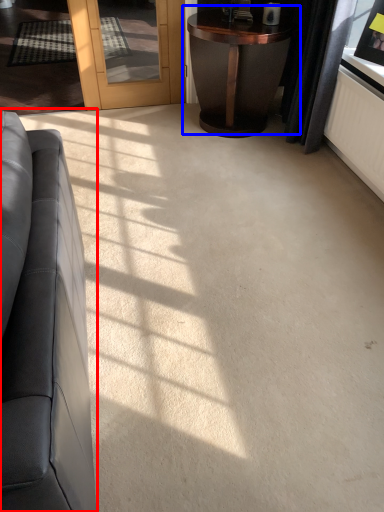
Question: Which object appears farthest to the camera in this image, studio couch (highlighted by a red box) or table (highlighted by a blue box)?

Choices:
 (A) studio couch
 (B) table

Answer: (B)